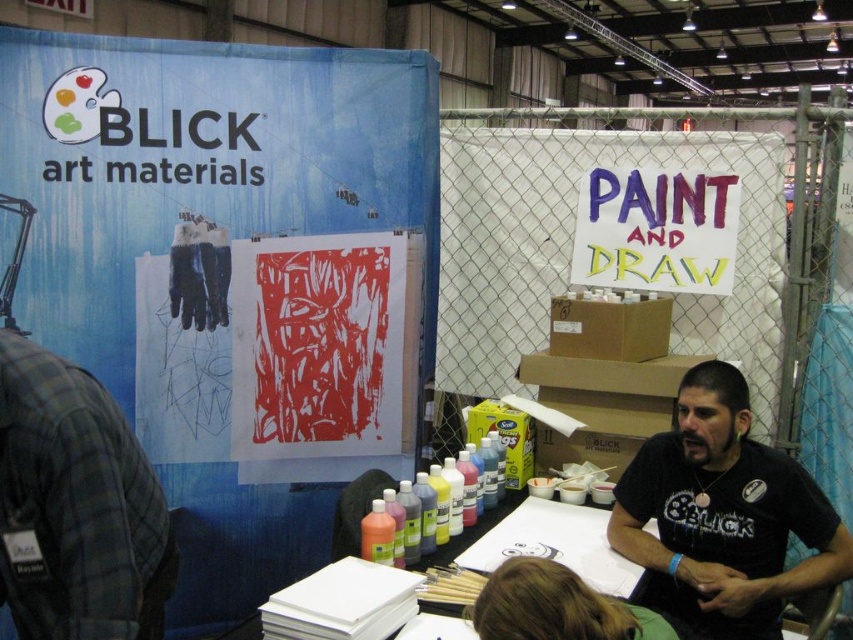
Consider the image. Measure the distance between point (436, 138) and camera.

Point (436, 138) is 8.45 feet away from camera.

Does matte paper poster at upper left appear over red linoleum print at center?

Indeed, matte paper poster at upper left is positioned over red linoleum print at center.

Measure the distance between point (x=260, y=58) and camera.

Point (x=260, y=58) is 2.38 meters from camera.

Where is `matte paper poster at upper left`? The height and width of the screenshot is (640, 853). matte paper poster at upper left is located at coordinates (229, 244).

Identify the location of plaid flannel shirt at left. The width and height of the screenshot is (853, 640). (76, 506).

Who is shorter, plaid flannel shirt at left or matte paint sign at center?

Standing shorter between the two is matte paint sign at center.

Does point (18, 436) lie behind point (601, 234)?

No.

The image size is (853, 640). Find the location of `plaid flannel shirt at left`. plaid flannel shirt at left is located at coordinates (76, 506).

Does matte paint sign at center have a greater width compared to matte plastic bottles at center?

Yes.

Is point (675, 227) positioned after point (595, 506)?

Yes.

Does point (718, 188) come closer to viewer compared to point (347, 493)?

That is False.

Locate an element on the screen. The height and width of the screenshot is (640, 853). matte paint sign at center is located at coordinates (656, 230).